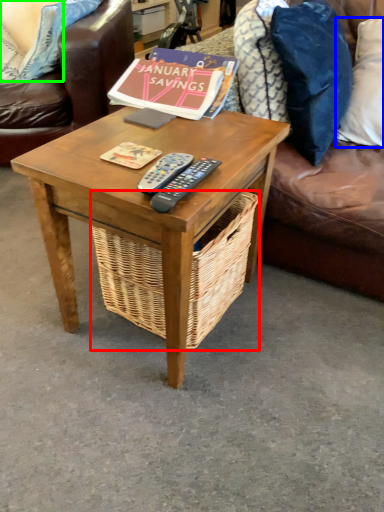
Question: Which object is positioned farthest from picnic basket (highlighted by a red box)? Select from pillow (highlighted by a blue box) and pillow (highlighted by a green box).

Choices:
 (A) pillow
 (B) pillow

Answer: (B)